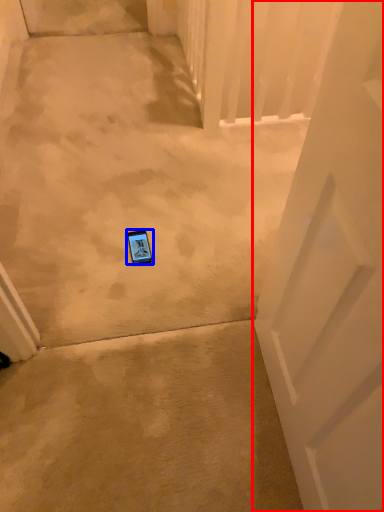
Question: Which point is closer to the camera, door (highlighted by a red box) or gadget (highlighted by a blue box)?

Choices:
 (A) door
 (B) gadget

Answer: (A)